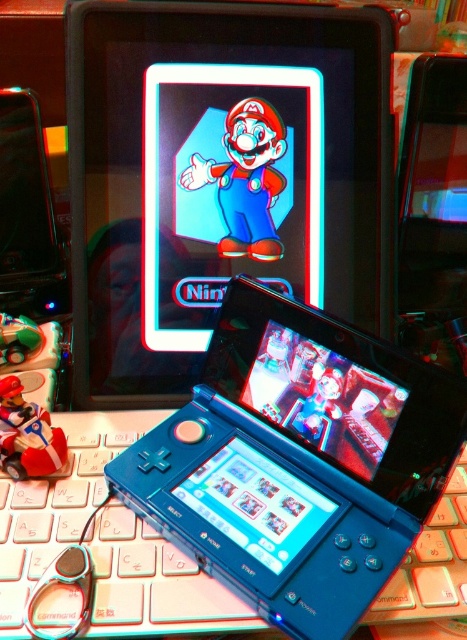
Question: Does blue plastic laptop at center have a smaller size compared to matte blue nintendo ds at center?

Choices:
 (A) no
 (B) yes

Answer: (A)

Question: Which object is farther from the camera taking this photo?

Choices:
 (A) matte blue nintendo ds at center
 (B) matte red figure at lower left
 (C) white plastic keyboard at center
 (D) blue plastic laptop at center

Answer: (A)

Question: Is white plastic keyboard at center closer to camera compared to matte blue nintendo ds at center?

Choices:
 (A) yes
 (B) no

Answer: (A)

Question: Estimate the real-world distances between objects in this image. Which object is closer to the matte blue nintendo ds at center?

Choices:
 (A) white plastic keyboard at center
 (B) blue plastic laptop at center

Answer: (B)

Question: Which object appears farthest from the camera in this image?

Choices:
 (A) matte red figure at lower left
 (B) blue plastic laptop at center
 (C) white plastic keyboard at center
 (D) matte blue nintendo ds at center

Answer: (D)

Question: Does white plastic keyboard at center have a larger size compared to matte red figure at lower left?

Choices:
 (A) yes
 (B) no

Answer: (A)